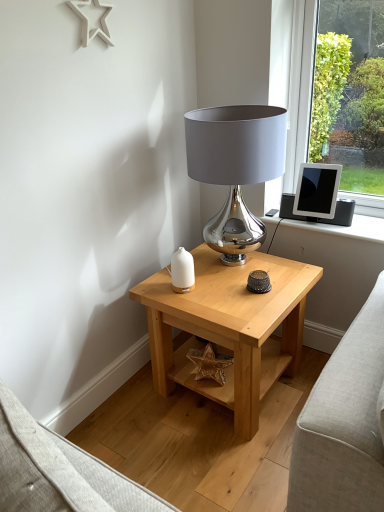
Question: Should I look upward or downward to see white glossy vase at center?

Choices:
 (A) up
 (B) down

Answer: (B)

Question: Is white glossy vase at center further to the viewer compared to shiny metallic lamp at upper center?

Choices:
 (A) yes
 (B) no

Answer: (A)

Question: Is white glossy vase at center located outside shiny metallic lamp at upper center?

Choices:
 (A) no
 (B) yes

Answer: (B)

Question: Can you confirm if white glossy vase at center is positioned to the right of shiny metallic lamp at upper center?

Choices:
 (A) no
 (B) yes

Answer: (A)

Question: Does white glossy vase at center have a smaller size compared to shiny metallic lamp at upper center?

Choices:
 (A) no
 (B) yes

Answer: (B)

Question: From a real-world perspective, is white glossy vase at center under shiny metallic lamp at upper center?

Choices:
 (A) yes
 (B) no

Answer: (A)

Question: Can you confirm if white glossy vase at center is positioned to the left of shiny metallic lamp at upper center?

Choices:
 (A) yes
 (B) no

Answer: (A)

Question: Is silver metallic tablet at upper right shorter than shiny metallic lamp at upper center?

Choices:
 (A) yes
 (B) no

Answer: (A)

Question: Considering the relative positions of silver metallic tablet at upper right and shiny metallic lamp at upper center in the image provided, is silver metallic tablet at upper right to the left of shiny metallic lamp at upper center from the viewer's perspective?

Choices:
 (A) no
 (B) yes

Answer: (A)

Question: Is silver metallic tablet at upper right wider than shiny metallic lamp at upper center?

Choices:
 (A) yes
 (B) no

Answer: (B)

Question: Considering the relative positions of silver metallic tablet at upper right and shiny metallic lamp at upper center in the image provided, is silver metallic tablet at upper right behind shiny metallic lamp at upper center?

Choices:
 (A) yes
 (B) no

Answer: (A)

Question: From the image's perspective, is silver metallic tablet at upper right located above shiny metallic lamp at upper center?

Choices:
 (A) no
 (B) yes

Answer: (B)

Question: Is silver metallic tablet at upper right closer to the viewer compared to shiny metallic lamp at upper center?

Choices:
 (A) yes
 (B) no

Answer: (B)

Question: Is shiny metallic lamp at upper center not close to natural wood side table at center?

Choices:
 (A) no
 (B) yes

Answer: (A)